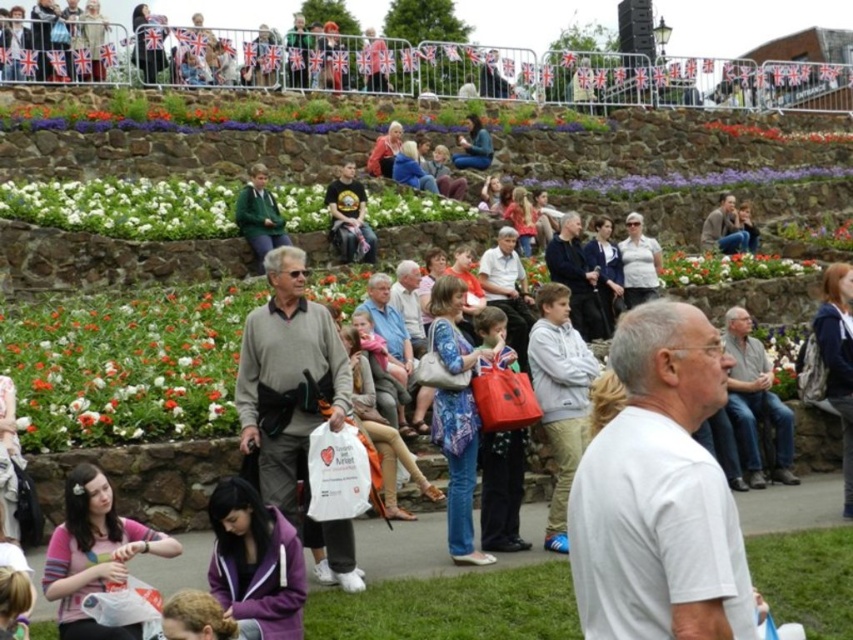
In the scene described, there is a white cotton shirt at center and a floral fabric flower at center. Which object takes up more space in the image?

The white cotton shirt at center is larger in size than the floral fabric flower at center, so the white cotton shirt at center takes up more space in the image.

Based on the photo, you are organizing a clothing donation drive and need to pack items into boxes. You have a box that can only fit items with a thickness of 3 cm or less. You have the pink fabric shirt at lower left and the green sweater at center. Which of these items can safely be placed in the box without exceeding the thickness limit?

The pink fabric shirt at lower left is thinner than the green sweater at center. Since the box can only hold items up to 3 cm thick, the pink fabric shirt at lower left can be safely placed in the box, but the green sweater at center may exceed the limit and should be checked for exact thickness before placing.